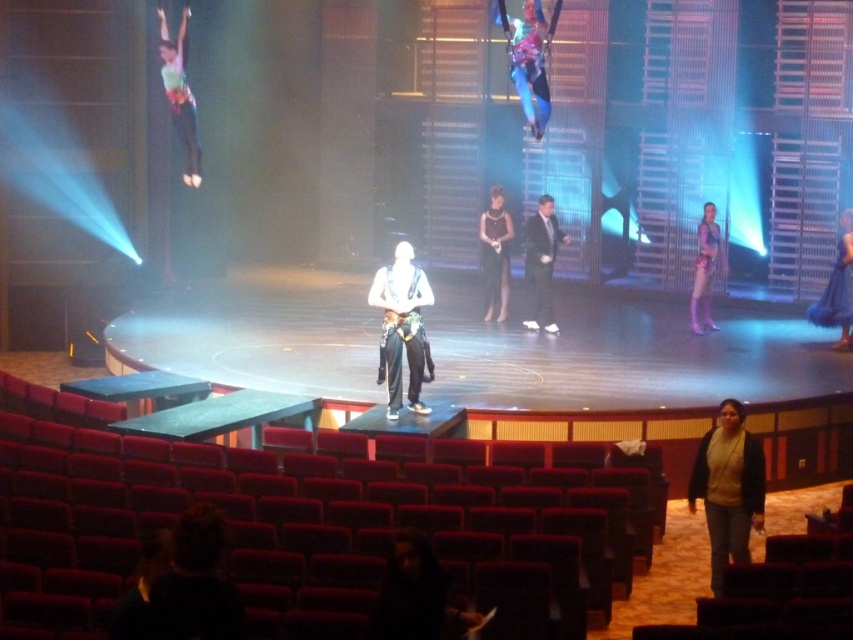
Question: Does shiny black suit at center appear on the right side of black satin dress at center?

Choices:
 (A) no
 (B) yes

Answer: (B)

Question: Which object is the farthest from the jeans at lower right?

Choices:
 (A) shiny blue dress at center
 (B) purple metallic costume at right
 (C) black satin dress at center
 (D) matte green fabric at upper left

Answer: (D)

Question: Does shiny metallic costume at upper center have a larger size compared to shiny blue dress at center?

Choices:
 (A) yes
 (B) no

Answer: (A)

Question: Which point is closer to the camera taking this photo?

Choices:
 (A) (546, 109)
 (B) (822, 291)

Answer: (A)

Question: Does shiny blue dress at center have a smaller size compared to purple metallic costume at right?

Choices:
 (A) yes
 (B) no

Answer: (A)

Question: Estimate the real-world distances between objects in this image. Which object is closer to the shiny black suit at center?

Choices:
 (A) white matte pants at center
 (B) purple metallic costume at right

Answer: (B)